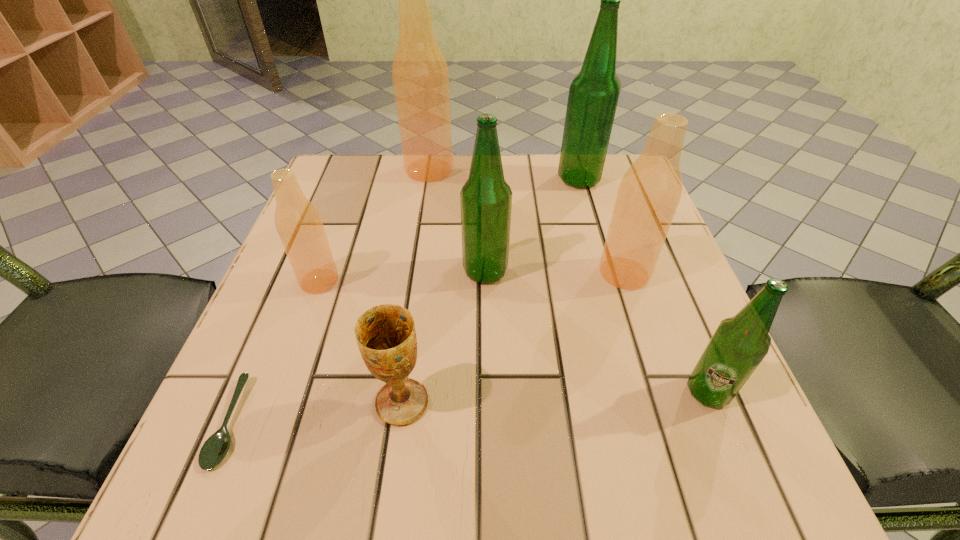
Find the location of a particular element. This screenshot has height=540, width=960. vacant space located on the left of the second smallest tan beer bottle is located at coordinates (561, 273).

Image resolution: width=960 pixels, height=540 pixels. I want to click on free space located on the back of the leftmost beer bottle, so click(363, 160).

You are a GUI agent. You are given a task and a screenshot of the screen. Output one action in this format:
    pyautogui.click(x=<x>, y=<y>)
    Task: Click on the vacant region located on the label of the nearest beer bottle
    
    Given the screenshot: What is the action you would take?
    pyautogui.click(x=746, y=485)

At what (x,y) coordinates should I click in order to perform the action: click on free space located on the right of the seventh tallest object. Please return your answer as a coordinate pair (x, y). Looking at the image, I should click on (519, 402).

I want to click on vacant area located on the back of the shortest object, so click(294, 272).

At what (x,y) coordinates should I click in order to perform the action: click on object that is at the near edge. Please return your answer as a coordinate pair (x, y). Looking at the image, I should click on (216, 447).

The height and width of the screenshot is (540, 960). Find the location of `beer bottle located in the left edge section of the desktop`. beer bottle located in the left edge section of the desktop is located at coordinates (299, 225).

Locate an element on the screen. soupspoon at the left edge is located at coordinates (216, 447).

Where is `object located at the near left corner`? Image resolution: width=960 pixels, height=540 pixels. object located at the near left corner is located at coordinates click(x=216, y=447).

This screenshot has height=540, width=960. I want to click on object positioned at the far right corner, so click(x=593, y=96).